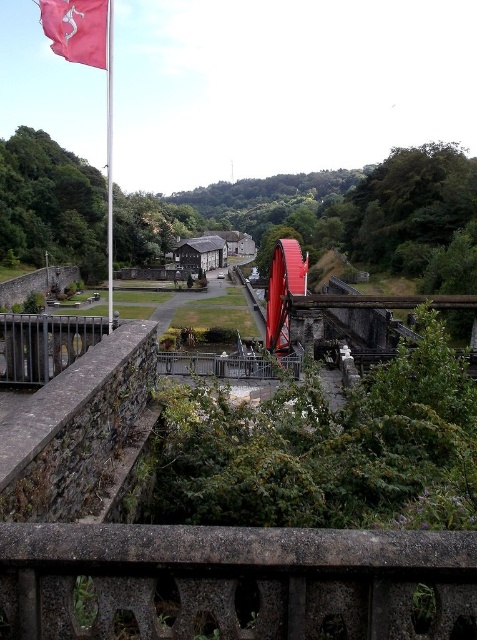
Is concrete textured balustrade at lower center shorter than pink fabric flag at upper left?

Indeed, concrete textured balustrade at lower center has a lesser height compared to pink fabric flag at upper left.

Does point (467, 592) come in front of point (71, 51)?

Yes.

I want to click on concrete textured balustrade at lower center, so click(235, 579).

Can you confirm if concrete textured balustrade at lower center is positioned above red metallic flag pole at upper left?

Actually, concrete textured balustrade at lower center is below red metallic flag pole at upper left.

Between concrete textured balustrade at lower center and red metallic flag pole at upper left, which one is positioned lower?

concrete textured balustrade at lower center is lower down.

In order to click on concrete textured balustrade at lower center in this screenshot , I will do `click(235, 579)`.

Is point (50, 20) in front of point (109, 92)?

That is True.

This screenshot has width=477, height=640. Describe the element at coordinates (78, 29) in the screenshot. I see `pink fabric flag at upper left` at that location.

Identify the location of pink fabric flag at upper left. Image resolution: width=477 pixels, height=640 pixels. (x=78, y=29).